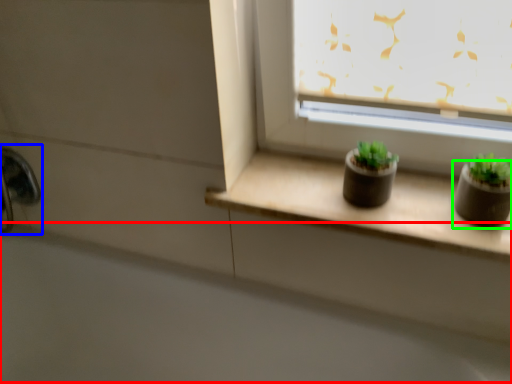
Question: Considering the real-world distances, which object is farthest from bath (highlighted by a red box)? faucet (highlighted by a blue box) or flowerpot (highlighted by a green box)?

Choices:
 (A) faucet
 (B) flowerpot

Answer: (B)